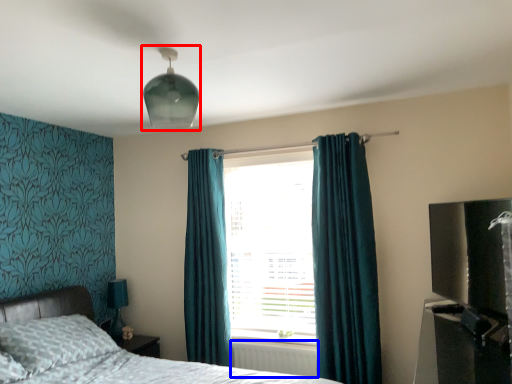
Question: Among these objects, which one is nearest to the camera, light fixture (highlighted by a red box) or radiator (highlighted by a blue box)?

Choices:
 (A) light fixture
 (B) radiator

Answer: (A)